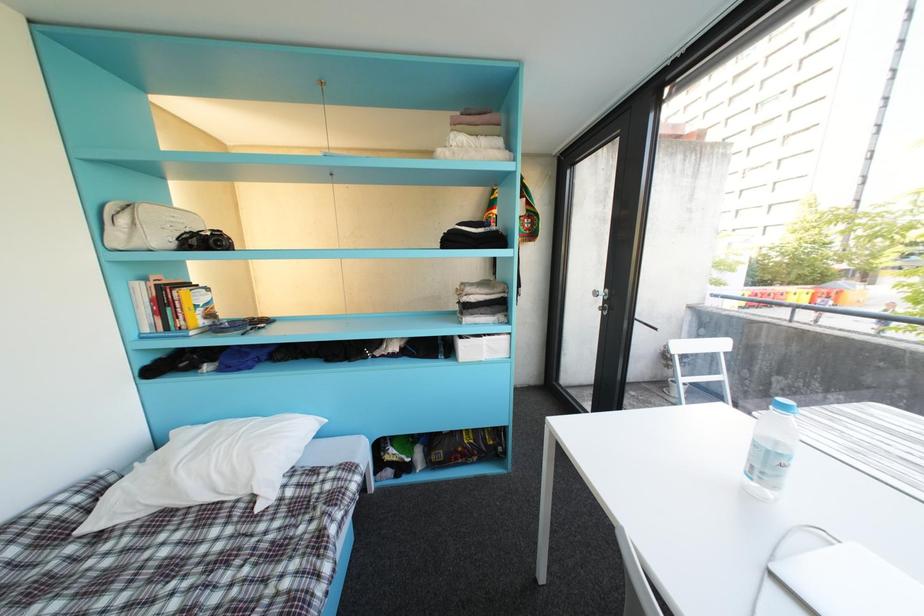
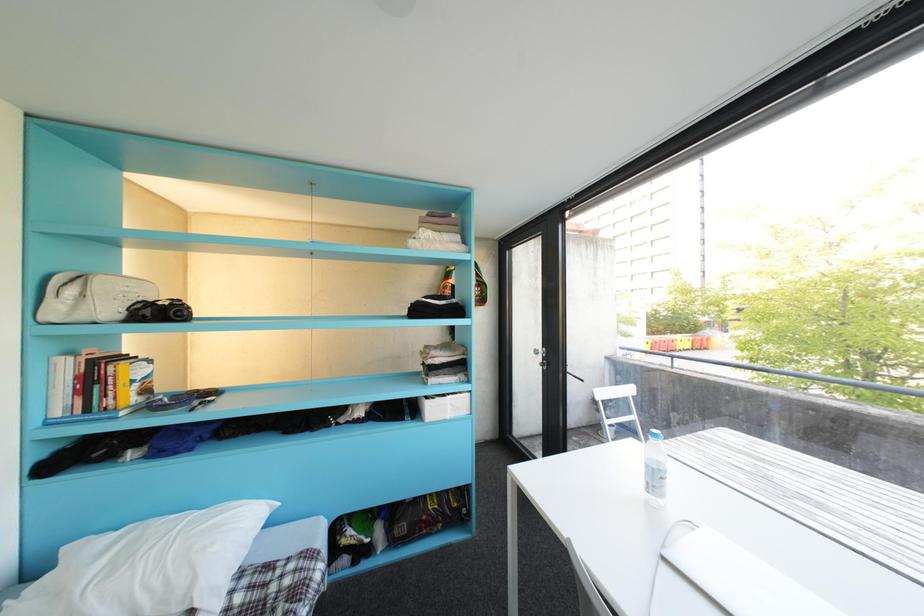
The images are taken continuously from a first-person perspective. In which direction are you moving?

The movement direction of the cameraman is left, backward.